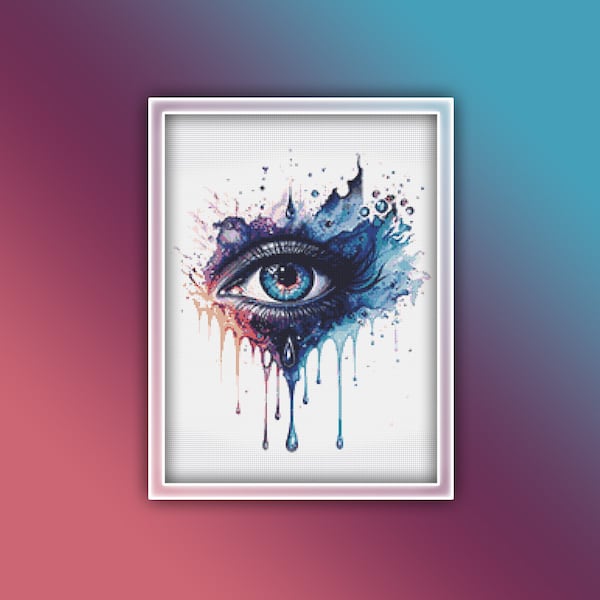
Where is `picture frame`? This screenshot has width=600, height=600. picture frame is located at coordinates (447, 215), (270, 491), (153, 299), (275, 105).